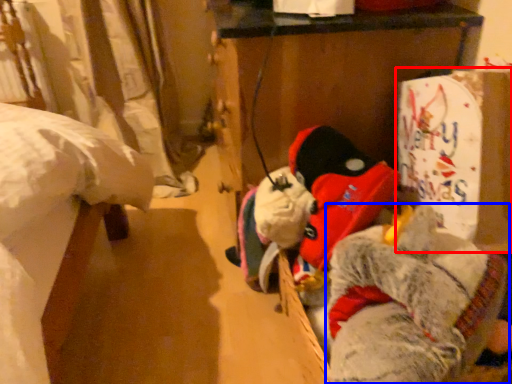
Question: Which object appears closest to the camera in this image, cardboard box (highlighted by a red box) or animal (highlighted by a blue box)?

Choices:
 (A) cardboard box
 (B) animal

Answer: (B)